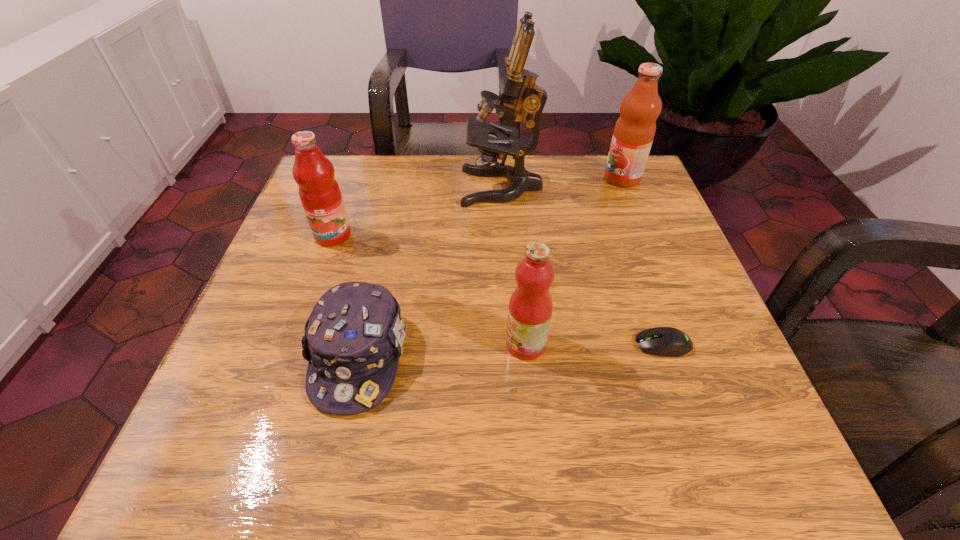
Where is `the tallest object`? The height and width of the screenshot is (540, 960). the tallest object is located at coordinates (518, 90).

Where is `the farthest fruit juice`? This screenshot has height=540, width=960. the farthest fruit juice is located at coordinates (634, 131).

You are a GUI agent. You are given a task and a screenshot of the screen. Output one action in this format:
    pyautogui.click(x=<x>, y=<y>)
    Task: Click on the fourth nearest object
    The image size is (960, 540).
    Given the screenshot: What is the action you would take?
    pyautogui.click(x=319, y=192)

You are a GUI agent. You are given a task and a screenshot of the screen. Output one action in this format:
    pyautogui.click(x=<x>, y=<y>)
    Task: Click on the leftmost fruit juice
    
    Given the screenshot: What is the action you would take?
    pyautogui.click(x=319, y=192)

Locate an element on the screen. the nearest fruit juice is located at coordinates (x=530, y=308).

Find the location of a particular element. This screenshot has height=540, width=960. the second shortest object is located at coordinates (353, 339).

This screenshot has height=540, width=960. I want to click on computer mouse, so click(x=660, y=341).

The width and height of the screenshot is (960, 540). I want to click on free location located at the eyepieces of the microscope, so tap(350, 187).

Locate an element on the screen. This screenshot has width=960, height=540. vacant space situated at the eyepieces of the microscope is located at coordinates (343, 187).

Find the location of a particular element. This screenshot has width=960, height=540. vacant space located 0.280m at the eyepieces of the microscope is located at coordinates (347, 187).